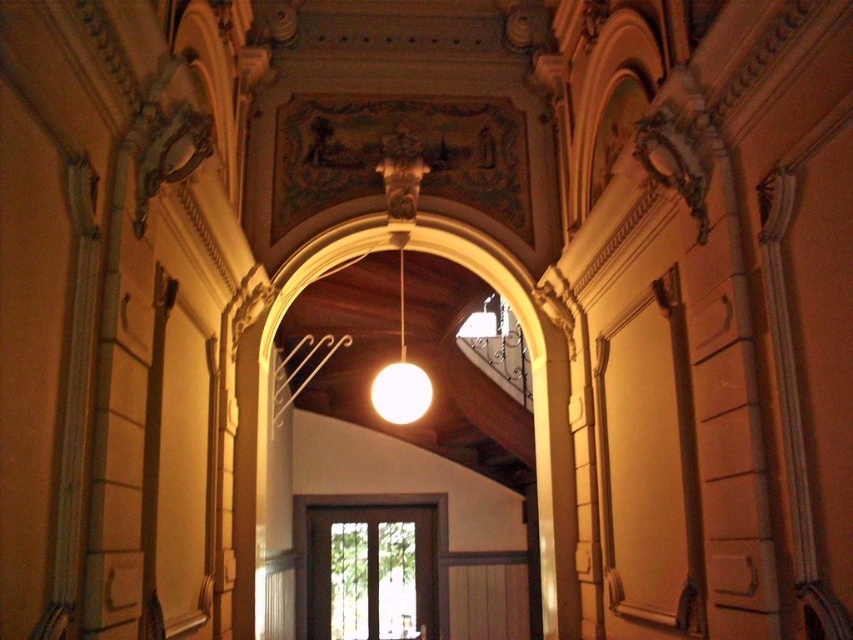
You are standing in the hallway and want to reach the point at coordinates point (444, 557). Given that the hallway is narrow, do you think you can walk straight to it without any obstacles?

The point (444, 557) is 37.11 feet away from the camera. Since the hallway is narrow but the distance is clear, you can walk straight to it without obstacles.

You are an interior designer planning to install a new chandelier in this hallway. The existing pendant light is hanging directly above the matte glass door at center. If you want to place the new chandelier above the matte white sphere at center instead, will it be possible to hang it at the same height as the existing pendant light?

The matte glass door at center is taller than the matte white sphere at center. Since the existing pendant light is above the door, hanging a chandelier at the same height above the sphere would require adjusting the height based on the sphere being shorter. The chandelier could be hung lower to match the sphere or kept at the same height as the door, but the sphere itself is shorter. However, the question specifies hanging it at the same height as the existing pendant light, so yes, it is possible as the h

You are a delivery person carrying a large package that is 6 meters long. You need to move it through the hallway. Based on the distance between the matte glass door at center and the matte white sphere at center, will the package fit through the hallway?

The distance between the matte glass door at center and the matte white sphere at center is 5.64 meters. Since the package is 6 meters long, it is longer than the available space between them, so the package will not fit through the hallway.